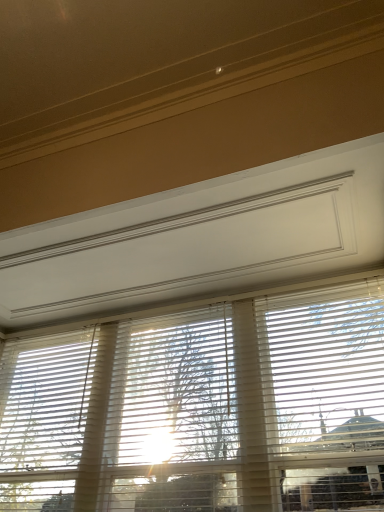
Question: Based on their positions, is white matte blinds at right located to the left or right of white matte blinds at center?

Choices:
 (A) right
 (B) left

Answer: (A)

Question: From their relative heights in the image, would you say white matte blinds at right is taller or shorter than white matte blinds at center?

Choices:
 (A) short
 (B) tall

Answer: (A)

Question: Estimate the real-world distances between objects in this image. Which object is closer to the white matte blinds at right?

Choices:
 (A) translucent wood tree at center
 (B) white matte blinds at center

Answer: (B)

Question: Which of these objects is positioned closest to the white matte blinds at center?

Choices:
 (A) white matte blinds at right
 (B) translucent wood tree at center

Answer: (B)